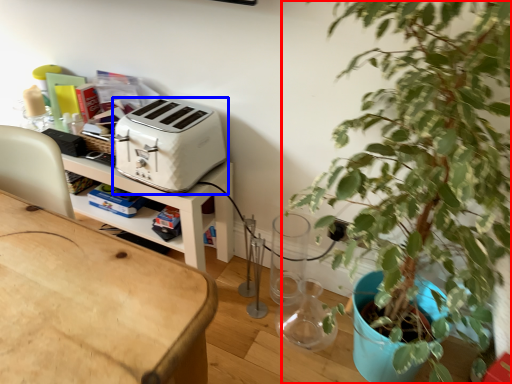
Question: Which object appears farthest to the camera in this image, houseplant (highlighted by a red box) or toaster (highlighted by a blue box)?

Choices:
 (A) houseplant
 (B) toaster

Answer: (B)